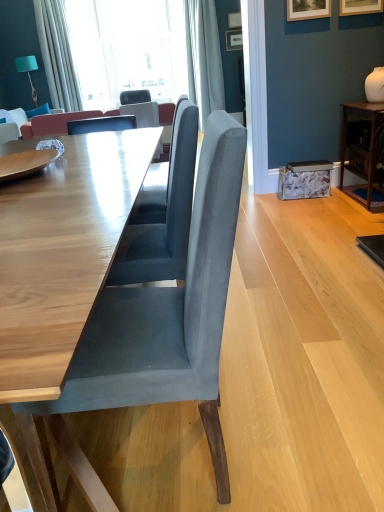
The image size is (384, 512). What are the coordinates of `wooden picture frame at upper right, marked as the 3th picture frame in a top-to-bottom arrangement` in the screenshot? It's located at (360, 7).

The width and height of the screenshot is (384, 512). What do you see at coordinates (360, 7) in the screenshot? I see `wooden picture frame at upper right, acting as the fourth picture frame starting from the back` at bounding box center [360, 7].

Locate an element on the screen. This screenshot has width=384, height=512. teal fabric lampshade at upper left is located at coordinates (28, 72).

Where is `wooden picture frame at upper center, the second picture frame when ordered from back to front`? This screenshot has width=384, height=512. wooden picture frame at upper center, the second picture frame when ordered from back to front is located at coordinates (234, 20).

From the image's perspective, which object appears higher, wooden picture frame at upper right, acting as the first picture frame starting from the bottom, or velvet blue pillow at upper left?

From the image's view, velvet blue pillow at upper left is above.

From the image's perspective, count 2nd picture frames downward from the velvet blue pillow at upper left and point to it. Please provide its 2D coordinates.

[(308, 9)]

Does point (306, 16) come farther from viewer compared to point (30, 111)?

No, it is not.

Is velvet blue pillow at upper left at the back of wooden picture frame at upper right, acting as the first picture frame starting from the bottom?

No, velvet blue pillow at upper left is not at the back of wooden picture frame at upper right, acting as the first picture frame starting from the bottom.

Could you tell me if suede gray chair at center, arranged as the 1th chair when viewed from the right, is turned towards slate gray fabric chair at center, marked as the third chair in a right-to-left arrangement?

No, suede gray chair at center, arranged as the 1th chair when viewed from the right, is not turned towards slate gray fabric chair at center, marked as the third chair in a right-to-left arrangement.

Considering the points (210, 388) and (140, 90), which point is behind, point (210, 388) or point (140, 90)?

Positioned behind is point (140, 90).

Is the position of suede gray chair at center, which appears as the third chair when viewed from the back, more distant than that of slate gray fabric chair at center, the 1th chair when ordered from back to front?

No, suede gray chair at center, which appears as the third chair when viewed from the back, is closer to the camera.

Are suede gray chair at center, the first chair from the bottom, and slate gray fabric chair at center, which is counted as the 3th chair, starting from the bottom, located far from each other?

Yes, suede gray chair at center, the first chair from the bottom, and slate gray fabric chair at center, which is counted as the 3th chair, starting from the bottom, are quite far apart.

Where is `lamp located behind the satin fabric curtain at upper center, which ranks as the 2th curtain in left-to-right order`? lamp located behind the satin fabric curtain at upper center, which ranks as the 2th curtain in left-to-right order is located at coordinates (28, 72).

Is satin fabric curtain at upper center, which ranks as the 2th curtain in left-to-right order, aimed at teal fabric lampshade at upper left?

No, satin fabric curtain at upper center, which ranks as the 2th curtain in left-to-right order, is not turned towards teal fabric lampshade at upper left.

From their relative heights in the image, would you say satin fabric curtain at upper center, which ranks as the 2th curtain in left-to-right order, is taller or shorter than teal fabric lampshade at upper left?

Considering their sizes, satin fabric curtain at upper center, which ranks as the 2th curtain in left-to-right order, has more height than teal fabric lampshade at upper left.

Is there a large distance between satin fabric curtain at upper center, which ranks as the 2th curtain in left-to-right order, and teal fabric lampshade at upper left?

Absolutely, satin fabric curtain at upper center, which ranks as the 2th curtain in left-to-right order, is distant from teal fabric lampshade at upper left.

Is teal fabric lampshade at upper left positioned before slate gray fabric chair at center, arranged as the 2th chair when viewed from the left?

No.

From a real-world perspective, is teal fabric lampshade at upper left over slate gray fabric chair at center, placed as the second chair when sorted from back to front?

Indeed, from a real-world perspective, teal fabric lampshade at upper left stands above slate gray fabric chair at center, placed as the second chair when sorted from back to front.

Is teal fabric lampshade at upper left not close to slate gray fabric chair at center, arranged as the 2th chair when viewed from the left?

Indeed, teal fabric lampshade at upper left is not near slate gray fabric chair at center, arranged as the 2th chair when viewed from the left.

Considering the sizes of objects teal fabric lampshade at upper left and slate gray fabric chair at center, which ranks as the second chair in front-to-back order, in the image provided, who is taller, teal fabric lampshade at upper left or slate gray fabric chair at center, which ranks as the second chair in front-to-back order,?

teal fabric lampshade at upper left.

Is teal fabric lampshade at upper left looking in the opposite direction of slate gray fabric chair at center, the 1th chair when ordered from back to front?

No, slate gray fabric chair at center, the 1th chair when ordered from back to front, is not at the back of teal fabric lampshade at upper left.

Is the depth of teal fabric lampshade at upper left greater than that of slate gray fabric chair at center, arranged as the 1th chair when viewed from the left?

No, it is not.

At what (x,y) coordinates should I click in order to perform the action: click on chair behind the teal fabric lampshade at upper left. Please return your answer as a coordinate pair (x, y). This screenshot has width=384, height=512. Looking at the image, I should click on (135, 97).

Does teal fabric lampshade at upper left have a lesser width compared to slate gray fabric chair at center, which is the first chair in top-to-bottom order?

Indeed, teal fabric lampshade at upper left has a lesser width compared to slate gray fabric chair at center, which is the first chair in top-to-bottom order.

From a real-world perspective, is teal fabric lampshade at upper left physically above wooden picture frame at upper right, acting as the first picture frame starting from the bottom?

No, from a real-world perspective, teal fabric lampshade at upper left is not above wooden picture frame at upper right, acting as the first picture frame starting from the bottom.

Considering the positions of points (27, 66) and (296, 16), is point (27, 66) closer to camera compared to point (296, 16)?

No.

Consider the image. From the image's perspective, who appears lower, teal fabric lampshade at upper left or wooden picture frame at upper right, the fourth picture frame when ordered from top to bottom?

wooden picture frame at upper right, the fourth picture frame when ordered from top to bottom, from the image's perspective.

Can you confirm if wooden picture frame at upper right, marked as the 3th picture frame in a top-to-bottom arrangement, is bigger than wooden picture frame at upper center, which is the second picture frame from top to bottom?

No.

Which is behind, wooden picture frame at upper right, marked as the 3th picture frame in a top-to-bottom arrangement, or wooden picture frame at upper center, which is the second picture frame from top to bottom?

wooden picture frame at upper center, which is the second picture frame from top to bottom, is behind.

From the picture: Is wooden picture frame at upper right, acting as the 1th picture frame starting from the front, at the right side of wooden picture frame at upper center, marked as the 1th picture frame in a back-to-front arrangement?

Yes, wooden picture frame at upper right, acting as the 1th picture frame starting from the front, is to the right of wooden picture frame at upper center, marked as the 1th picture frame in a back-to-front arrangement.

Find the location of a particular element. pillow that is above the wooden picture frame at upper right, acting as the first picture frame starting from the bottom (from the image's perspective) is located at coordinates (38, 111).

From a real-world perspective, starting from the suede gray chair at center, the third chair in the top-to-bottom sequence, which chair is the 2nd one vertically above it? Please provide its 2D coordinates.

[(135, 97)]

Consider the image. Which object lies further to the anchor point wooden table at center, placed as the first table when sorted from front to back, wooden picture frame at upper center, which is the second picture frame from top to bottom, or wooden picture frame at upper right, acting as the fourth picture frame starting from the back?

wooden picture frame at upper center, which is the second picture frame from top to bottom, lies further to wooden table at center, placed as the first table when sorted from front to back, than the other object.

From the image, which object appears to be nearer to satin fabric curtain at upper center, which ranks as the 2th curtain in left-to-right order, wooden table at center, placed as the first table when sorted from front to back, or wooden picture frame at upper center, the 4th picture frame positioned from the bottom?

wooden picture frame at upper center, the 4th picture frame positioned from the bottom, is positioned closer to the anchor satin fabric curtain at upper center, which ranks as the 2th curtain in left-to-right order.

When comparing their distances from suede gray chair at center, the 3th chair viewed from the left, does satin fabric curtain at upper center, which is the 1th curtain in right-to-left order, or wooden picture frame at upper right, marked as the 3th picture frame in a top-to-bottom arrangement, seem closer?

satin fabric curtain at upper center, which is the 1th curtain in right-to-left order.

Estimate the real-world distances between objects in this image. Which object is further from dark wood table at right, which ranks as the 1th table in back-to-front order, white fabric curtain at upper left, which is the 1th curtain from left to right, or wooden picture frame at upper right, acting as the fourth picture frame starting from the back?

white fabric curtain at upper left, which is the 1th curtain from left to right, is positioned further to the anchor dark wood table at right, which ranks as the 1th table in back-to-front order.

From the image, which object appears to be nearer to velvet blue pillow at upper left, teal fabric lampshade at upper left or wooden picture frame at upper center, marked as the 1th picture frame in a back-to-front arrangement?

Based on the image, teal fabric lampshade at upper left appears to be nearer to velvet blue pillow at upper left.

Estimate the real-world distances between objects in this image. Which object is further from dark wood table at right, which is the second table from left to right, velvet blue pillow at upper left or wooden picture frame at upper center, the 4th picture frame positioned from the bottom?

Among the two, velvet blue pillow at upper left is located further to dark wood table at right, which is the second table from left to right.

Based on their spatial positions, is wooden picture frame at upper right, which appears as the 2th picture frame when ordered from the bottom, or satin fabric curtain at upper center, which is the 1th curtain in right-to-left order, closer to teal fabric lampshade at upper left?

satin fabric curtain at upper center, which is the 1th curtain in right-to-left order, lies closer to teal fabric lampshade at upper left than the other object.

Looking at the image, which one is located further to dark wood table at right, which ranks as the 1th table in back-to-front order, teal fabric lampshade at upper left or white fabric curtain at upper left, which is the 1th curtain from left to right?

teal fabric lampshade at upper left lies further to dark wood table at right, which ranks as the 1th table in back-to-front order, than the other object.

This screenshot has height=512, width=384. Find the location of `chair between wooden table at center, placed as the first table when sorted from front to back, and teal fabric lampshade at upper left from front to back`. chair between wooden table at center, placed as the first table when sorted from front to back, and teal fabric lampshade at upper left from front to back is located at coordinates (142, 113).

Image resolution: width=384 pixels, height=512 pixels. I want to click on chair between wooden table at center, which is the 2th table from right to left, and wooden picture frame at upper center, the second picture frame when ordered from back to front, from front to back, so click(142, 113).

This screenshot has height=512, width=384. What are the coordinates of `chair located between dark wood table at right, which is the second table from left to right, and wooden picture frame at upper center, marked as the 1th picture frame in a back-to-front arrangement, in the depth direction` in the screenshot? It's located at (142, 113).

You are a GUI agent. You are given a task and a screenshot of the screen. Output one action in this format:
    pyautogui.click(x=<x>, y=<y>)
    Task: Click on the chair located between wooden picture frame at upper right, acting as the first picture frame starting from the bottom, and velvet blue pillow at upper left in the depth direction
    This screenshot has width=384, height=512.
    Given the screenshot: What is the action you would take?
    pyautogui.click(x=142, y=113)